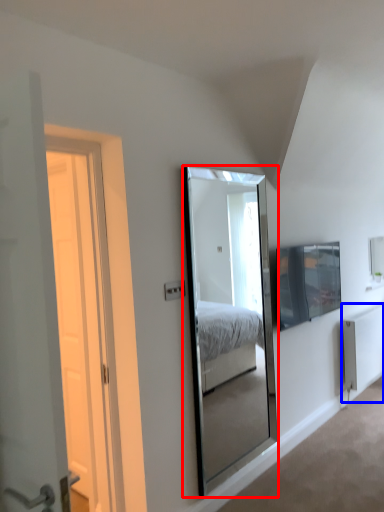
Question: Which object appears farthest to the camera in this image, mirror (highlighted by a red box) or radiator (highlighted by a blue box)?

Choices:
 (A) mirror
 (B) radiator

Answer: (B)